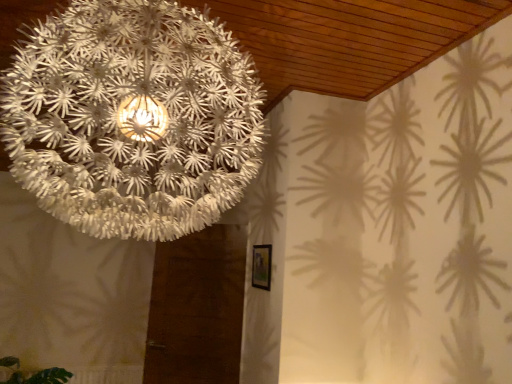
Question: Which is correct: white paper lampshade at upper center is inside green leafy plant at lower left, or outside of it?

Choices:
 (A) outside
 (B) inside

Answer: (A)

Question: Is white paper lampshade at upper center taller or shorter than green leafy plant at lower left?

Choices:
 (A) tall
 (B) short

Answer: (A)

Question: In terms of width, does white paper lampshade at upper center look wider or thinner when compared to green leafy plant at lower left?

Choices:
 (A) wide
 (B) thin

Answer: (A)

Question: In the image, is green leafy plant at lower left positioned in front of or behind white paper lampshade at upper center?

Choices:
 (A) behind
 (B) front

Answer: (A)

Question: From their relative heights in the image, would you say green leafy plant at lower left is taller or shorter than white paper lampshade at upper center?

Choices:
 (A) short
 (B) tall

Answer: (A)

Question: Considering the positions of green leafy plant at lower left and white paper lampshade at upper center in the image, is green leafy plant at lower left bigger or smaller than white paper lampshade at upper center?

Choices:
 (A) small
 (B) big

Answer: (A)

Question: Do you think green leafy plant at lower left is within white paper lampshade at upper center, or outside of it?

Choices:
 (A) outside
 (B) inside

Answer: (A)